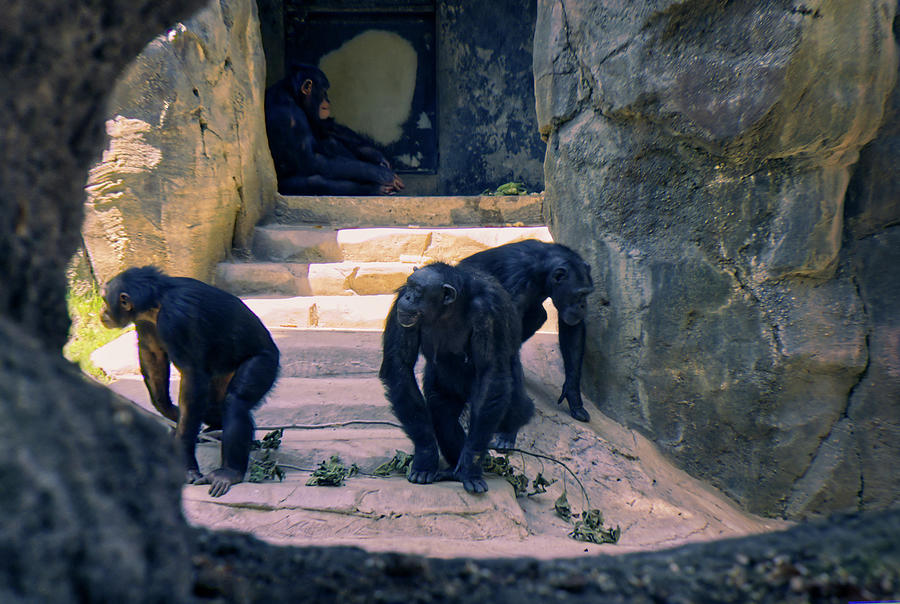
The height and width of the screenshot is (604, 900). In order to click on door in this screenshot , I will do pos(360,47).